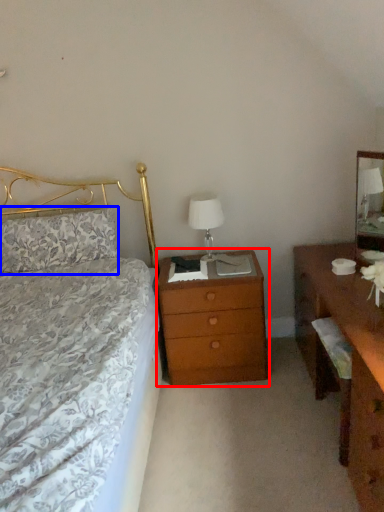
Question: Which of the following is the farthest to the observer, nightstand (highlighted by a red box) or pillow (highlighted by a blue box)?

Choices:
 (A) nightstand
 (B) pillow

Answer: (B)